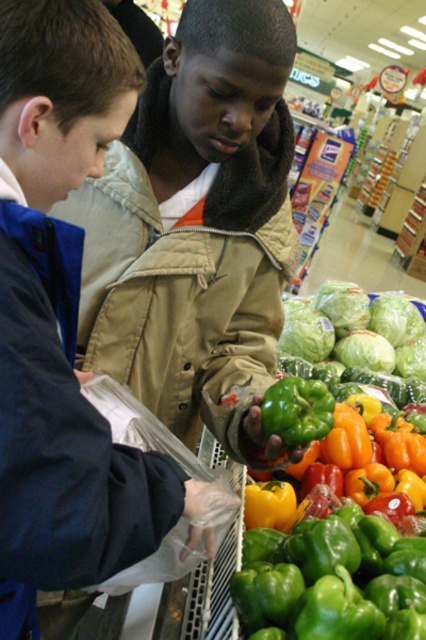
You are a customer in the grocery store and want to pick up the green matte bell pepper at center. Which direction should you move relative to the matte khaki jacket at center?

The matte khaki jacket at center is to the left of the green matte bell pepper at center. Therefore, you should move to the right relative to the matte khaki jacket at center to reach the green matte bell pepper at center.

You are standing in the grocery store and want to pick up an item located at point A and another item at point B. If point A is at coordinates point (192, 323) and point B is at coordinates point (382, 419), which point is closer to you?

Point A at coordinates point (192, 323) is closer to you than point B at coordinates point (382, 419).

You are a store employee and need to restock the green matte bell pepper at center. The shelf is currently at eye level. Where should you place the new peppers in relation to the matte khaki jacket at center?

Since the matte khaki jacket at center is located above the green matte bell pepper at center, you should place the new peppers below the matte khaki jacket at center to maintain the correct position.